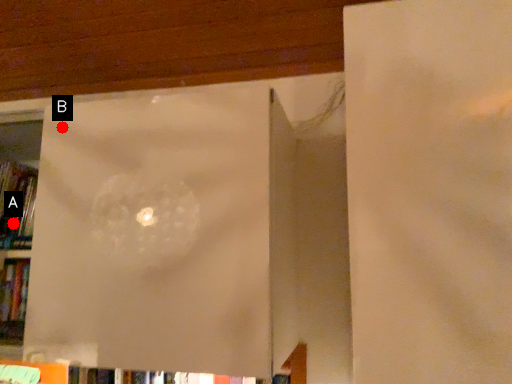
Question: Two points are circled on the image, labeled by A and B beside each circle. Which point appears farthest from the camera in this image?

Choices:
 (A) A is further
 (B) B is further

Answer: (A)